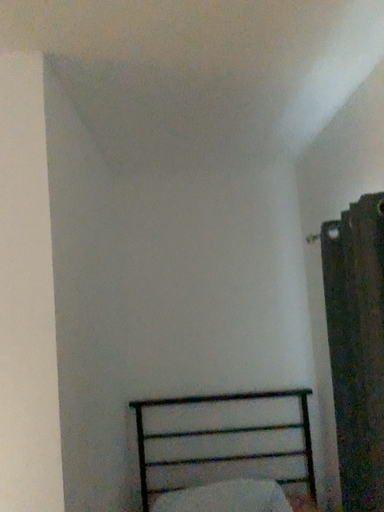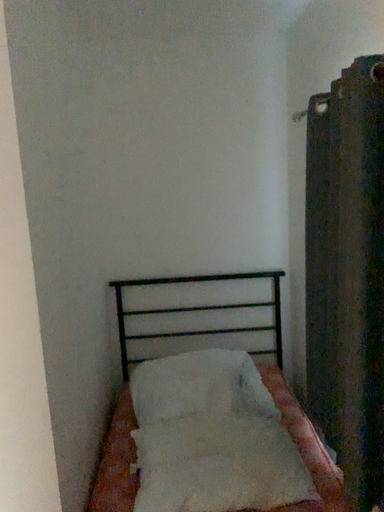
Question: Which way did the camera rotate in the video?

Choices:
 (A) rotated upward
 (B) rotated downward

Answer: (B)